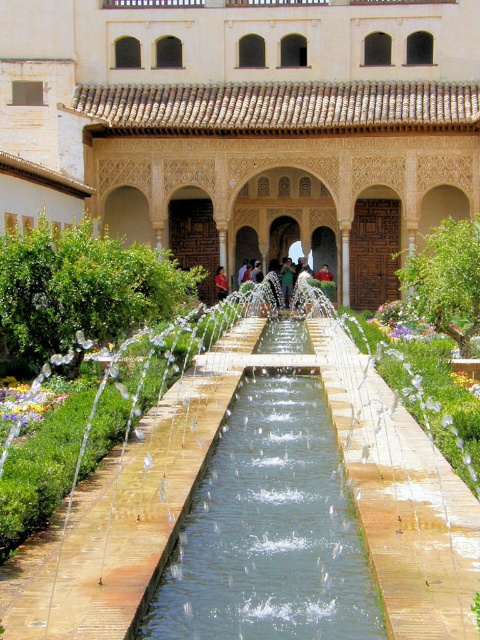
You are standing in the garden and want to take a photo of both the brown wooden palace at center and the red fabric person at center. Which object should you position closer to the camera to ensure both are in focus?

The brown wooden palace at center is located above the red fabric person at center, so you should position the camera closer to the red fabric person at center to ensure both are in focus.

You are standing in the garden and see two fabric people, the green fabric person at center and the red fabric person at center. Which one is positioned lower in the image?

The green fabric person at center is positioned lower than the red fabric person at center.